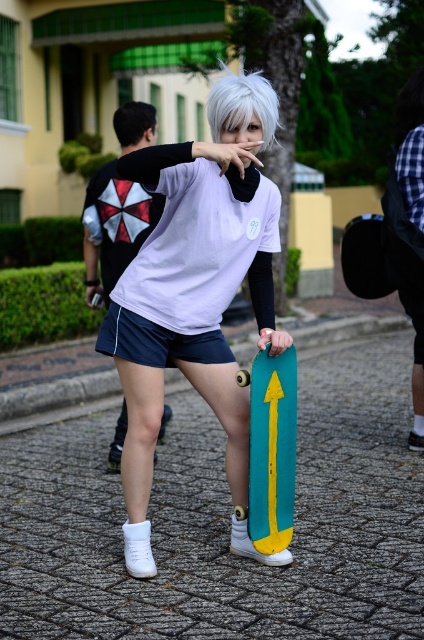
Can you confirm if cobblestone pavement at center is positioned above teal matte skateboard at center?

No.

Is cobblestone pavement at center further to the viewer compared to teal matte skateboard at center?

No.

Does point (180, 560) come behind point (267, 458)?

Yes, point (180, 560) is farther from viewer.

You are a GUI agent. You are given a task and a screenshot of the screen. Output one action in this format:
    pyautogui.click(x=<x>, y=<y>)
    Task: Click on the cobblestone pavement at center
    
    Given the screenshot: What is the action you would take?
    pyautogui.click(x=225, y=522)

Who is shorter, cobblestone pavement at center or white matte wig at center?

cobblestone pavement at center is shorter.

Is point (306, 376) in front of point (262, 97)?

That is False.

Is point (379, 385) behind point (214, 109)?

Yes, it is.

Find the location of a particular element. The width and height of the screenshot is (424, 640). cobblestone pavement at center is located at coordinates (225, 522).

Does matte white shorts at center have a greater height compared to white matte wig at center?

Yes.

Is matte white shorts at center shorter than white matte wig at center?

No, matte white shorts at center is not shorter than white matte wig at center.

Measure the distance between point (108, 237) and camera.

Point (108, 237) is 6.85 meters away from camera.

Find the location of `matte white shorts at center`. matte white shorts at center is located at coordinates (116, 227).